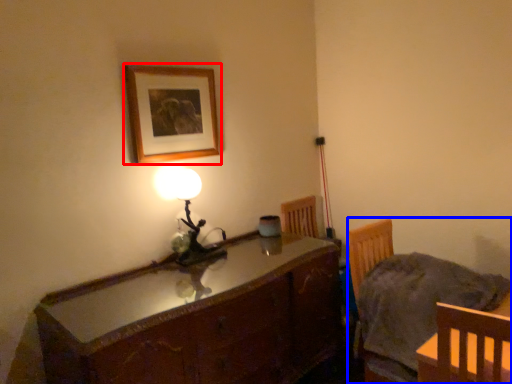
Question: Which of the following is the farthest to the observer, picture frame (highlighted by a red box) or chair (highlighted by a blue box)?

Choices:
 (A) picture frame
 (B) chair

Answer: (A)